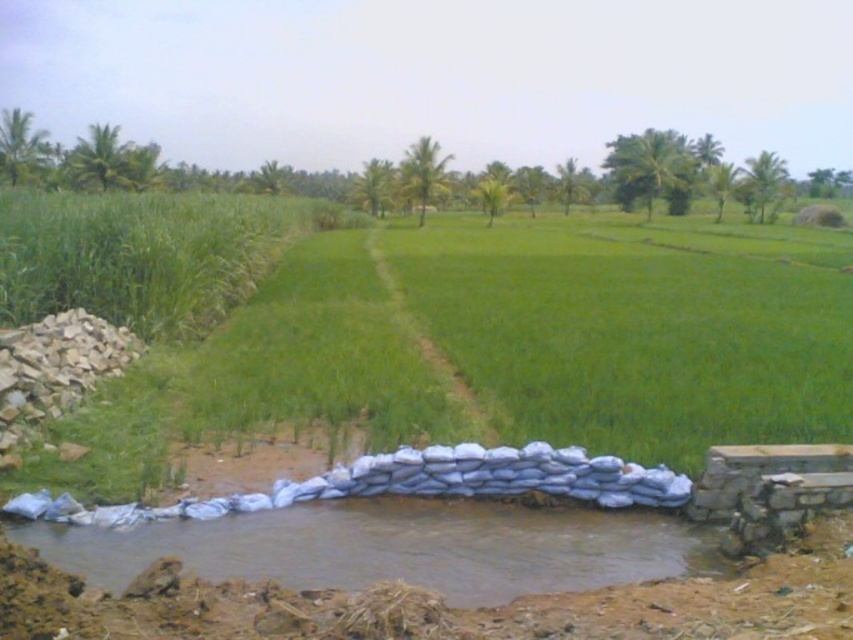
Question: Can you confirm if green grass at center is smaller than brown clay water at lower left?

Choices:
 (A) yes
 (B) no

Answer: (B)

Question: Does green grass at center have a greater width compared to brown clay water at lower left?

Choices:
 (A) no
 (B) yes

Answer: (B)

Question: Which of the following is the farthest from the observer?

Choices:
 (A) green grass at center
 (B) brown clay water at lower left

Answer: (A)

Question: Which point appears closest to the camera in this image?

Choices:
 (A) (451, 500)
 (B) (676, 339)

Answer: (A)

Question: Is green grass at center thinner than brown clay water at lower left?

Choices:
 (A) no
 (B) yes

Answer: (A)